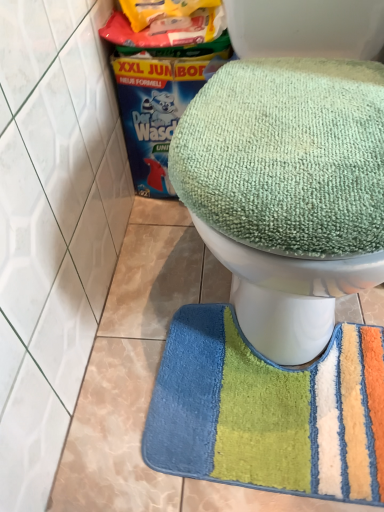
Describe the element at coordinates (261, 409) in the screenshot. I see `multicolored plush bath mat at lower center` at that location.

This screenshot has height=512, width=384. I want to click on multicolored plush bath mat at lower center, so click(x=261, y=409).

This screenshot has height=512, width=384. In order to click on green fabric toilet at upper center in this screenshot , I will do `click(287, 191)`.

Consider the image. In order to face green fabric toilet at upper center, should I rotate leftwards or rightwards?

Turn right by 14.532 degrees to look at green fabric toilet at upper center.

What do you see at coordinates (287, 191) in the screenshot?
I see `green fabric toilet at upper center` at bounding box center [287, 191].

Find the location of `multicolored plush bath mat at lower center`. multicolored plush bath mat at lower center is located at coordinates (261, 409).

Which object is positioned more to the left, green fabric toilet at upper center or multicolored plush bath mat at lower center?

multicolored plush bath mat at lower center.

Which object is closer to the camera taking this photo, green fabric toilet at upper center or multicolored plush bath mat at lower center?

Positioned in front is green fabric toilet at upper center.

Is point (259, 193) closer or farther from the camera than point (235, 400)?

Point (259, 193) is closer to the camera than point (235, 400).

From the image's perspective, which one is positioned lower, green fabric toilet at upper center or multicolored plush bath mat at lower center?

From the image's view, multicolored plush bath mat at lower center is below.

Consider the image. From a real-world perspective, relative to multicolored plush bath mat at lower center, is green fabric toilet at upper center vertically above or below?

green fabric toilet at upper center is above multicolored plush bath mat at lower center.

Between green fabric toilet at upper center and multicolored plush bath mat at lower center, which one has smaller width?

multicolored plush bath mat at lower center.

Considering the sizes of objects green fabric toilet at upper center and multicolored plush bath mat at lower center in the image provided, who is shorter, green fabric toilet at upper center or multicolored plush bath mat at lower center?

Standing shorter between the two is multicolored plush bath mat at lower center.

Can you confirm if green fabric toilet at upper center is smaller than multicolored plush bath mat at lower center?

Incorrect, green fabric toilet at upper center is not smaller in size than multicolored plush bath mat at lower center.

Would you say green fabric toilet at upper center is outside multicolored plush bath mat at lower center?

Yes, green fabric toilet at upper center is located beyond the bounds of multicolored plush bath mat at lower center.

Is green fabric toilet at upper center touching multicolored plush bath mat at lower center?

There is a gap between green fabric toilet at upper center and multicolored plush bath mat at lower center.

Does green fabric toilet at upper center turn towards multicolored plush bath mat at lower center?

No, green fabric toilet at upper center is not turned towards multicolored plush bath mat at lower center.

Where is `toilet that appears above the multicolored plush bath mat at lower center (from a real-world perspective)`? The width and height of the screenshot is (384, 512). toilet that appears above the multicolored plush bath mat at lower center (from a real-world perspective) is located at coordinates (287, 191).

Considering the relative positions of multicolored plush bath mat at lower center and green fabric toilet at upper center in the image provided, is multicolored plush bath mat at lower center to the right of green fabric toilet at upper center from the viewer's perspective?

No.

Is multicolored plush bath mat at lower center further to camera compared to green fabric toilet at upper center?

Yes, multicolored plush bath mat at lower center is further from the camera.

Which point is more distant from viewer, (x=339, y=353) or (x=229, y=176)?

Positioned behind is point (x=339, y=353).

From the image's perspective, which is below, multicolored plush bath mat at lower center or green fabric toilet at upper center?

multicolored plush bath mat at lower center.

From a real-world perspective, is multicolored plush bath mat at lower center beneath green fabric toilet at upper center?

Indeed, from a real-world perspective, multicolored plush bath mat at lower center is positioned beneath green fabric toilet at upper center.

Is multicolored plush bath mat at lower center wider than green fabric toilet at upper center?

In fact, multicolored plush bath mat at lower center might be narrower than green fabric toilet at upper center.

In terms of height, does multicolored plush bath mat at lower center look taller or shorter compared to green fabric toilet at upper center?

Considering their sizes, multicolored plush bath mat at lower center has less height than green fabric toilet at upper center.

Considering the relative sizes of multicolored plush bath mat at lower center and green fabric toilet at upper center in the image provided, is multicolored plush bath mat at lower center smaller than green fabric toilet at upper center?

Yes, multicolored plush bath mat at lower center is smaller than green fabric toilet at upper center.

Is multicolored plush bath mat at lower center positioned beyond the bounds of green fabric toilet at upper center?

Yes, multicolored plush bath mat at lower center is not within green fabric toilet at upper center.

Is multicolored plush bath mat at lower center in contact with green fabric toilet at upper center?

No, multicolored plush bath mat at lower center is not with green fabric toilet at upper center.

Is multicolored plush bath mat at lower center oriented towards green fabric toilet at upper center?

No.

The height and width of the screenshot is (512, 384). I want to click on toilet above the multicolored plush bath mat at lower center (from the image's perspective), so click(x=287, y=191).

Find the location of a particular element. toilet that is above the multicolored plush bath mat at lower center (from the image's perspective) is located at coordinates (287, 191).

This screenshot has height=512, width=384. Find the location of `toilet that appears on the right of multicolored plush bath mat at lower center`. toilet that appears on the right of multicolored plush bath mat at lower center is located at coordinates (287, 191).